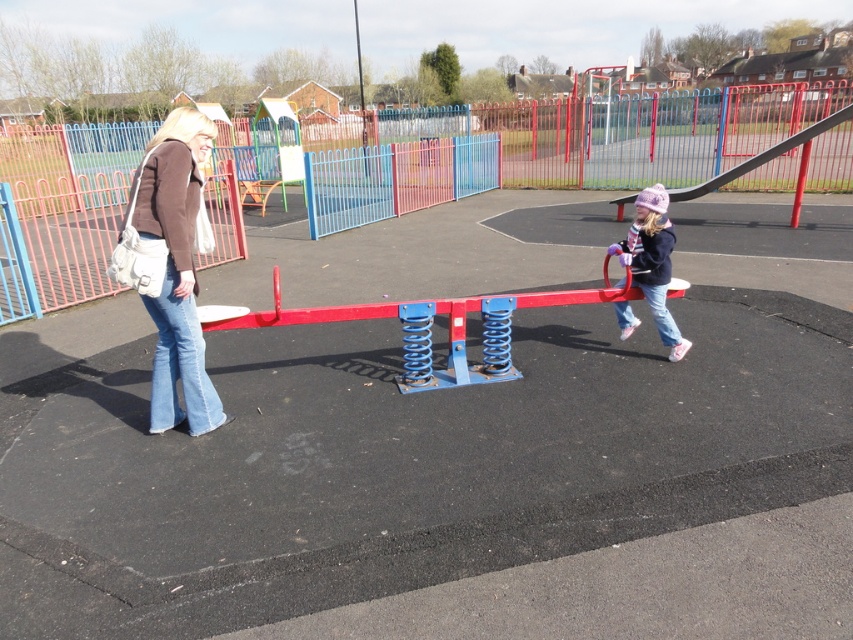
Question: Where is denim jeans at left located in relation to matte purple hat at center in the image?

Choices:
 (A) above
 (B) below

Answer: (B)

Question: Which of the following is the closest to the observer?

Choices:
 (A) (802, 138)
 (B) (196, 140)

Answer: (B)

Question: Considering the real-world distances, which object is farthest from the metallic gray slide at right?

Choices:
 (A) denim jeans at left
 (B) matte purple hat at center

Answer: (A)

Question: Considering the relative positions of denim jeans at left and matte purple hat at center in the image provided, where is denim jeans at left located with respect to matte purple hat at center?

Choices:
 (A) right
 (B) left

Answer: (B)

Question: Which of the following is the closest to the observer?

Choices:
 (A) metallic gray slide at right
 (B) matte purple hat at center
 (C) denim jeans at left

Answer: (C)

Question: Does matte purple hat at center appear over metallic gray slide at right?

Choices:
 (A) yes
 (B) no

Answer: (B)